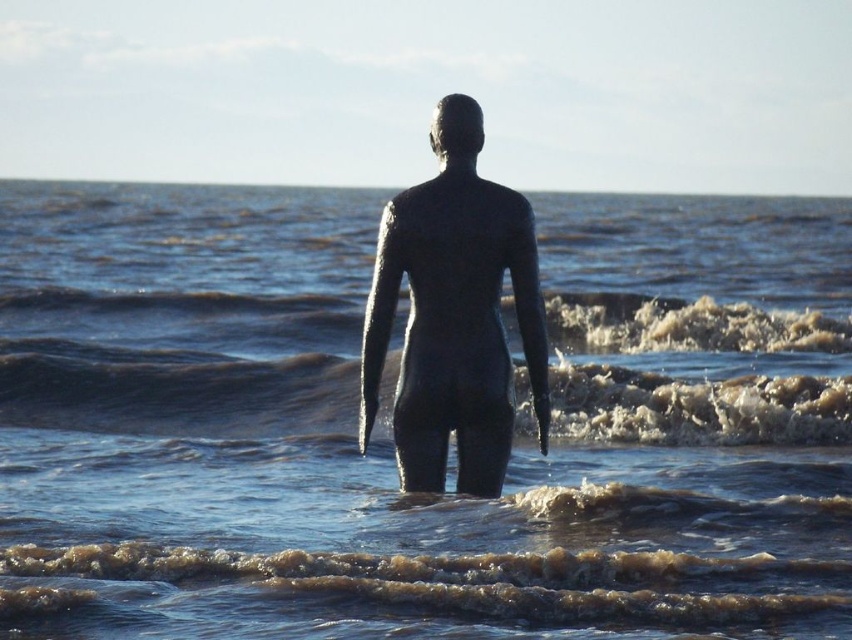
You are a photographer aiming to capture the bronze statue at center and the shiny metallic water at center in a single shot. Based on their positions, which object should you position closer to the left side of your camera frame to ensure both are visible?

You should position the bronze statue at center closer to the left side of your camera frame because the shiny metallic water at center is to the right of it, ensuring both objects are included in the shot.

You are a photographer wanting to capture the bronze statue at center in the foreground while including the brown textured water at center in the background. Based on the scene, will the statue appear larger or smaller in the photo compared to the water?

The bronze statue at center will appear smaller in the photo compared to the brown textured water at center because the brown textured water at center has a larger size.

You are an art student observing the sculpture in the water. You notice two types of water around the sculpture. Which one is closer to you, the shiny metallic water at center or the brown textured water at center?

The shiny metallic water at center is closer to the viewer than the brown textured water at center.